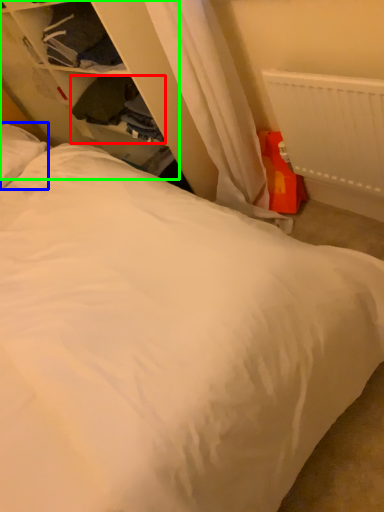
Question: Estimate the real-world distances between objects in this image. Which object is closer to clothing (highlighted by a red box), pillow (highlighted by a blue box) or dresser (highlighted by a green box)?

Choices:
 (A) pillow
 (B) dresser

Answer: (B)